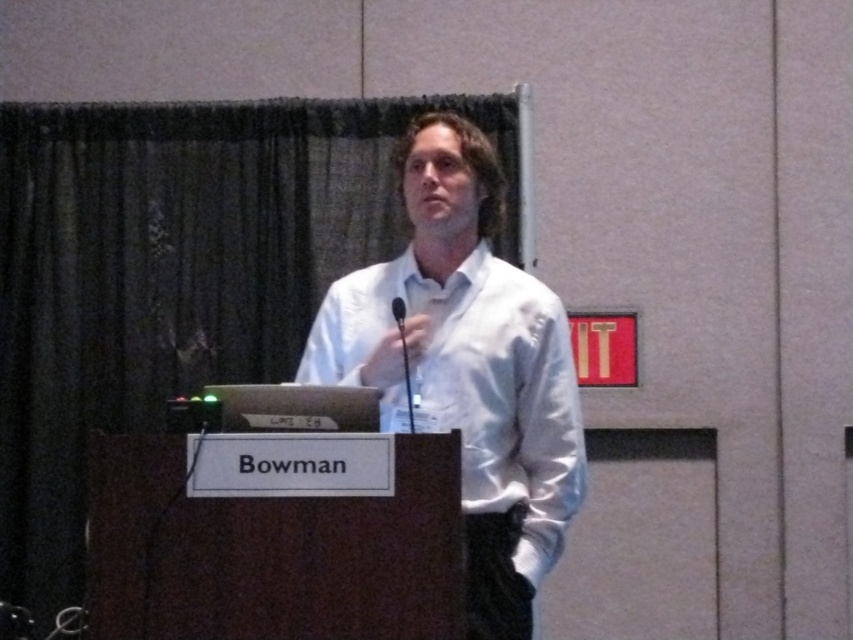
Who is lower down, white satin shirt at center or black matte microphone at center?

white satin shirt at center is lower down.

Which of these two, white satin shirt at center or black matte microphone at center, stands taller?

white satin shirt at center is taller.

Who is more forward, (399, 164) or (401, 305)?

Point (401, 305) is more forward.

Find the location of a particular element. This screenshot has height=640, width=853. white satin shirt at center is located at coordinates (468, 365).